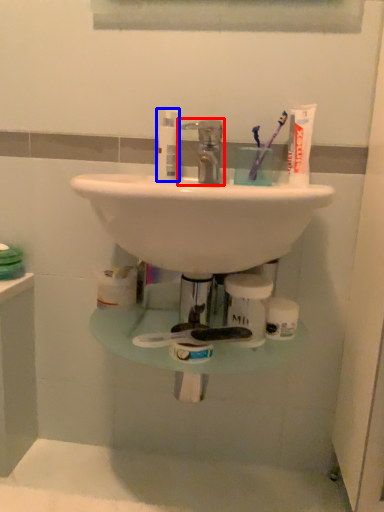
Question: Among these objects, which one is farthest to the camera, tap (highlighted by a red box) or toiletry (highlighted by a blue box)?

Choices:
 (A) tap
 (B) toiletry

Answer: (B)